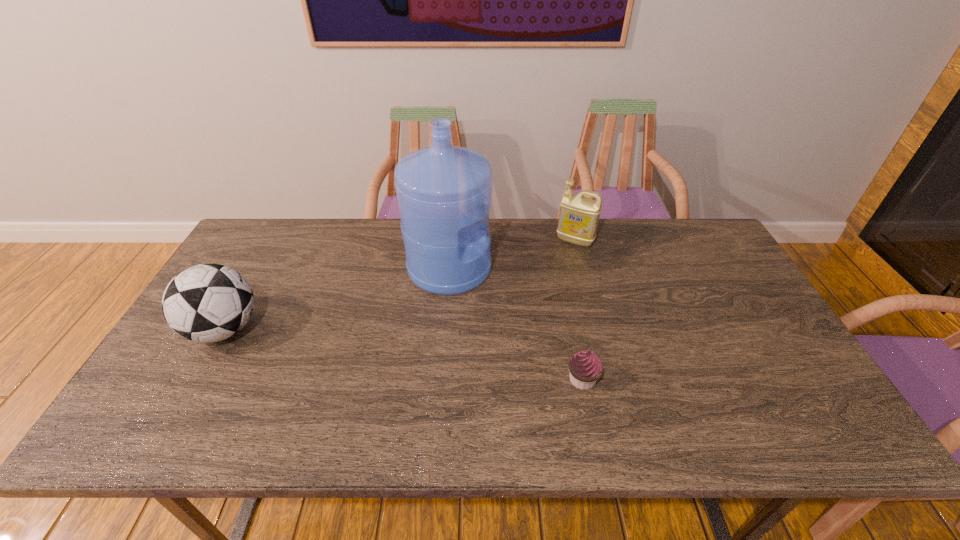
Locate an element on the screen. This screenshot has width=960, height=540. vacant space located 0.170m on the right of the cupcake is located at coordinates (669, 380).

Find the location of a particular element. Image resolution: width=960 pixels, height=540 pixels. water jug that is positioned at the far edge is located at coordinates (444, 192).

Locate an element on the screen. The image size is (960, 540). detergent present at the far edge is located at coordinates (x=578, y=219).

The width and height of the screenshot is (960, 540). I want to click on object at the left edge, so click(x=205, y=303).

Locate an element on the screen. The width and height of the screenshot is (960, 540). vacant space at the far edge of the desktop is located at coordinates (386, 222).

In the image, there is a desktop. Identify the location of free space at the near edge. The image size is (960, 540). (282, 412).

This screenshot has height=540, width=960. Identify the location of vacant area at the left edge. (238, 268).

In the image, there is a desktop. Where is `vacant space at the right edge`? This screenshot has height=540, width=960. vacant space at the right edge is located at coordinates (691, 285).

This screenshot has width=960, height=540. In the image, there is a desktop. Identify the location of blank space at the far left corner. (250, 239).

What are the coordinates of `vacant region at the far right corner of the desktop` in the screenshot? It's located at (672, 222).